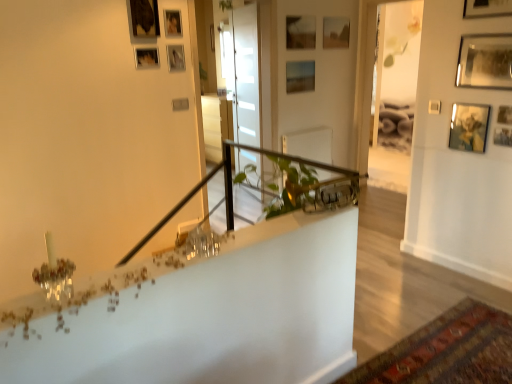
The height and width of the screenshot is (384, 512). What are the coordinates of `wooden picture frame at upper center, which ranks as the 9th picture frame in front-to-back order` in the screenshot? It's located at (300, 32).

The image size is (512, 384). What are the coordinates of `carpeted mat at lower right` in the screenshot? It's located at (446, 351).

Where is `transparent glass door at center`? transparent glass door at center is located at coordinates (245, 75).

Measure the distance between transparent glass door at center and camera.

transparent glass door at center and camera are 4.09 meters apart.

The width and height of the screenshot is (512, 384). Find the location of `matte wooden picture frame at upper center, arranged as the 1th picture frame when viewed from the back`. matte wooden picture frame at upper center, arranged as the 1th picture frame when viewed from the back is located at coordinates (336, 32).

Is matte wooden picture frame at upper center, the fifth picture frame in the right-to-left sequence, positioned far away from carpeted mat at lower right?

Yes, matte wooden picture frame at upper center, the fifth picture frame in the right-to-left sequence, and carpeted mat at lower right are quite far apart.

From their relative heights in the image, would you say matte wooden picture frame at upper center, the fifth picture frame in the right-to-left sequence, is taller or shorter than carpeted mat at lower right?

Considering their sizes, matte wooden picture frame at upper center, the fifth picture frame in the right-to-left sequence, has more height than carpeted mat at lower right.

Can we say matte wooden picture frame at upper center, marked as the 7th picture frame in a left-to-right arrangement, lies outside carpeted mat at lower right?

Indeed, matte wooden picture frame at upper center, marked as the 7th picture frame in a left-to-right arrangement, is completely outside carpeted mat at lower right.

Considering the relative sizes of metallic silver picture frame at upper right, which ranks as the 4th picture frame in right-to-left order, and wooden picture frame at upper right, the 9th picture frame from the back, in the image provided, is metallic silver picture frame at upper right, which ranks as the 4th picture frame in right-to-left order, shorter than wooden picture frame at upper right, the 9th picture frame from the back,?

No.

Is the depth of metallic silver picture frame at upper right, acting as the eighth picture frame starting from the left, less than that of wooden picture frame at upper right, the 1th picture frame positioned from the right?

Yes, metallic silver picture frame at upper right, acting as the eighth picture frame starting from the left, is in front of wooden picture frame at upper right, the 1th picture frame positioned from the right.

From a real-world perspective, which object rests below the other?

wooden picture frame at upper right, the 3th picture frame from the front.

Which of these two, metallic silver picture frame at upper right, which ranks as the 4th picture frame in right-to-left order, or wooden picture frame at upper right, the 9th picture frame from the back, is thinner?

wooden picture frame at upper right, the 9th picture frame from the back, is thinner.

Which is correct: transparent glass door at center is inside metallic silver picture frame at upper right, the 2th picture frame in the right-to-left sequence, or outside of it?

transparent glass door at center is spatially situated outside metallic silver picture frame at upper right, the 2th picture frame in the right-to-left sequence.

Which picture frame is the 7th one when counting from the front of the transparent glass door at center? Please provide its 2D coordinates.

[(485, 61)]

Is transparent glass door at center positioned far away from metallic silver picture frame at upper right, which appears as the second picture frame when viewed from the front?

Yes.

Between point (248, 79) and point (459, 48), which one is positioned in front?

The point (459, 48) is in front.

Where is `picture frame that is the 2nd object to the right of the metallic photo frame at upper center, acting as the eighth picture frame starting from the right, starting at the anchor`? picture frame that is the 2nd object to the right of the metallic photo frame at upper center, acting as the eighth picture frame starting from the right, starting at the anchor is located at coordinates (300, 76).

Is metallic photo frame at upper center, which ranks as the 4th picture frame in back-to-front order, taller or shorter than matte wooden picture frame at upper center, the 6th picture frame from the left?

Considering their sizes, metallic photo frame at upper center, which ranks as the 4th picture frame in back-to-front order, has less height than matte wooden picture frame at upper center, the 6th picture frame from the left.

Considering the positions of objects metallic photo frame at upper center, which ranks as the 4th picture frame in back-to-front order, and matte wooden picture frame at upper center, positioned as the sixth picture frame in right-to-left order, in the image provided, who is more to the right, metallic photo frame at upper center, which ranks as the 4th picture frame in back-to-front order, or matte wooden picture frame at upper center, positioned as the sixth picture frame in right-to-left order,?

matte wooden picture frame at upper center, positioned as the sixth picture frame in right-to-left order.

Can you tell me how much metallic photo frame at upper center, acting as the eighth picture frame starting from the right, and matte wooden picture frame at upper center, arranged as the 10th picture frame when viewed from the front, differ in facing direction?

There is a 0.0914-degree angle between the facing directions of metallic photo frame at upper center, acting as the eighth picture frame starting from the right, and matte wooden picture frame at upper center, arranged as the 10th picture frame when viewed from the front.

Would you say wooden picture frame at upper center, arranged as the third picture frame when viewed from the back, is outside wooden picture frame at upper right, which ranks as the eleventh picture frame in left-to-right order?

Indeed, wooden picture frame at upper center, arranged as the third picture frame when viewed from the back, is completely outside wooden picture frame at upper right, which ranks as the eleventh picture frame in left-to-right order.

From a real-world perspective, count 6th picture frames upward from the wooden picture frame at upper right, the 9th picture frame from the back, and point to it. Please provide its 2D coordinates.

[(300, 32)]

Is the depth of wooden picture frame at upper center, which ranks as the 9th picture frame in front-to-back order, less than that of wooden picture frame at upper right, which ranks as the eleventh picture frame in left-to-right order?

No, it is not.

Who is taller, wooden picture frame at upper center, arranged as the third picture frame when viewed from the back, or wooden picture frame at upper right, the 9th picture frame from the back?

wooden picture frame at upper center, arranged as the third picture frame when viewed from the back.

Is carpeted mat at lower right far away from wooden picture frame at upper right, the 1th picture frame positioned from the right?

Yes, carpeted mat at lower right and wooden picture frame at upper right, the 1th picture frame positioned from the right, are located far from each other.

Considering the points (367, 362) and (505, 112), which point is in front, point (367, 362) or point (505, 112)?

The point (367, 362) is more forward.

Considering the relative sizes of carpeted mat at lower right and wooden picture frame at upper right, the 9th picture frame from the back, in the image provided, is carpeted mat at lower right taller than wooden picture frame at upper right, the 9th picture frame from the back,?

In fact, carpeted mat at lower right may be shorter than wooden picture frame at upper right, the 9th picture frame from the back.

Between carpeted mat at lower right and wooden picture frame at upper right, the 3th picture frame from the front, which one has larger width?

carpeted mat at lower right is wider.

How many degrees apart are the facing directions of carpeted mat at lower right and matte wooden picture frame at upper center, the 2th picture frame positioned from the back?

The angular difference between carpeted mat at lower right and matte wooden picture frame at upper center, the 2th picture frame positioned from the back, is 180 degrees.

Can you see carpeted mat at lower right touching matte wooden picture frame at upper center, positioned as the sixth picture frame in right-to-left order?

There is a gap between carpeted mat at lower right and matte wooden picture frame at upper center, positioned as the sixth picture frame in right-to-left order.

Which is closer to the camera, (457, 321) or (289, 63)?

The point (457, 321) is in front.

Where is `mat below the matte wooden picture frame at upper center, positioned as the sixth picture frame in right-to-left order (from the image's perspective)`? The width and height of the screenshot is (512, 384). mat below the matte wooden picture frame at upper center, positioned as the sixth picture frame in right-to-left order (from the image's perspective) is located at coordinates (446, 351).

Image resolution: width=512 pixels, height=384 pixels. I want to click on mat below the matte wooden picture frame at upper center, the eleventh picture frame viewed from the front (from the image's perspective), so click(x=446, y=351).

At what (x,y) coordinates should I click in order to perform the action: click on the 3rd picture frame counting from the right of the metallic silver picture frame at upper right, positioned as the first picture frame in front-to-back order. Please return your answer as a coordinate pair (x, y). Looking at the image, I should click on (504, 115).

Based on their spatial positions, is metallic silver picture frame at upper right, positioned as the first picture frame in front-to-back order, or metallic silver picture frame at upper right, which appears as the second picture frame when viewed from the front, further from wooden picture frame at upper center, the fifth picture frame from the left?

metallic silver picture frame at upper right, which appears as the second picture frame when viewed from the front, lies further to wooden picture frame at upper center, the fifth picture frame from the left, than the other object.

From the image, which object appears to be nearer to matte wooden picture frame at upper center, acting as the 9th picture frame starting from the right, wooden picture frame at upper right, the 3th picture frame from the front, or carpeted mat at lower right?

wooden picture frame at upper right, the 3th picture frame from the front, is positioned closer to the anchor matte wooden picture frame at upper center, acting as the 9th picture frame starting from the right.

Which object lies further to the anchor point matte wooden picture frame at upper center, the 6th picture frame from the left, transparent glass door at center or wooden picture frame at upper center, which ranks as the 1th picture frame in left-to-right order?

wooden picture frame at upper center, which ranks as the 1th picture frame in left-to-right order, is positioned further to the anchor matte wooden picture frame at upper center, the 6th picture frame from the left.

Considering their positions, is metallic gold picture frame at upper right, marked as the 4th picture frame in a front-to-back arrangement, positioned closer to matte wooden picture frame at upper center, positioned as the 5th picture frame in back-to-front order, than matte wooden picture frame at upper center, the 2th picture frame positioned from the back?

The object closer to matte wooden picture frame at upper center, positioned as the 5th picture frame in back-to-front order, is matte wooden picture frame at upper center, the 2th picture frame positioned from the back.

From the image, which object appears to be nearer to metallic silver picture frame at upper right, the 2th picture frame in the right-to-left sequence, carpeted mat at lower right or matte wooden picture frame at upper center, the eleventh picture frame viewed from the front?

carpeted mat at lower right.

Considering their positions, is metallic silver picture frame at upper right, which appears as the second picture frame when viewed from the front, positioned further to wooden picture frame at upper center, the sixth picture frame viewed from the front, than metallic gold picture frame at upper right, the 9th picture frame from the left?

metallic gold picture frame at upper right, the 9th picture frame from the left, is further to wooden picture frame at upper center, the sixth picture frame viewed from the front.

Which object lies further to the anchor point wooden picture frame at upper right, the 9th picture frame from the back, metallic gold picture frame at upper right, positioned as the 8th picture frame in back-to-front order, or carpeted mat at lower right?

The object further to wooden picture frame at upper right, the 9th picture frame from the back, is carpeted mat at lower right.

Estimate the real-world distances between objects in this image. Which object is further from metallic silver picture frame at upper right, acting as the eighth picture frame starting from the left, metallic gold picture frame at upper right, the 9th picture frame from the left, or transparent glass door at center?

transparent glass door at center is further to metallic silver picture frame at upper right, acting as the eighth picture frame starting from the left.

Find the location of a particular element. This screenshot has height=384, width=512. mat located between metallic photo frame at upper center, the 4th picture frame when ordered from left to right, and metallic silver picture frame at upper right, the 2th picture frame in the right-to-left sequence, in the left-right direction is located at coordinates (446, 351).

This screenshot has height=384, width=512. In order to click on picture frame situated between matte wooden picture frame at upper center, which is counted as the 3th picture frame, starting from the left, and wooden picture frame at upper center, arranged as the third picture frame when viewed from the back, from left to right in this screenshot , I will do `click(176, 58)`.

Identify the location of glass door located between matte wooden picture frame at upper center, positioned as the 5th picture frame in back-to-front order, and metallic silver picture frame at upper right, which is the tenth picture frame from back to front, in the left-right direction. The image size is (512, 384). (245, 75).

Locate an element on the screen. This screenshot has width=512, height=384. glass door between matte wooden picture frame at upper center, which is counted as the 3th picture frame, starting from the left, and wooden picture frame at upper center, arranged as the third picture frame when viewed from the back, in the horizontal direction is located at coordinates (245, 75).